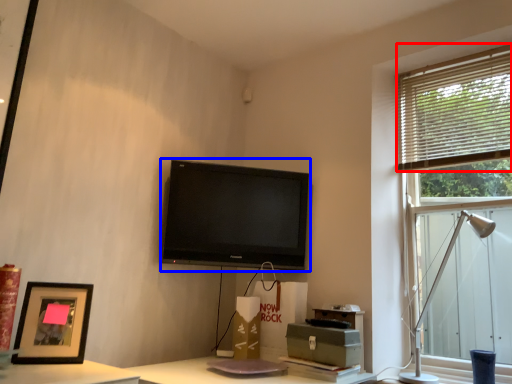
Question: Among these objects, which one is farthest to the camera, blind (highlighted by a red box) or television (highlighted by a blue box)?

Choices:
 (A) blind
 (B) television

Answer: (B)